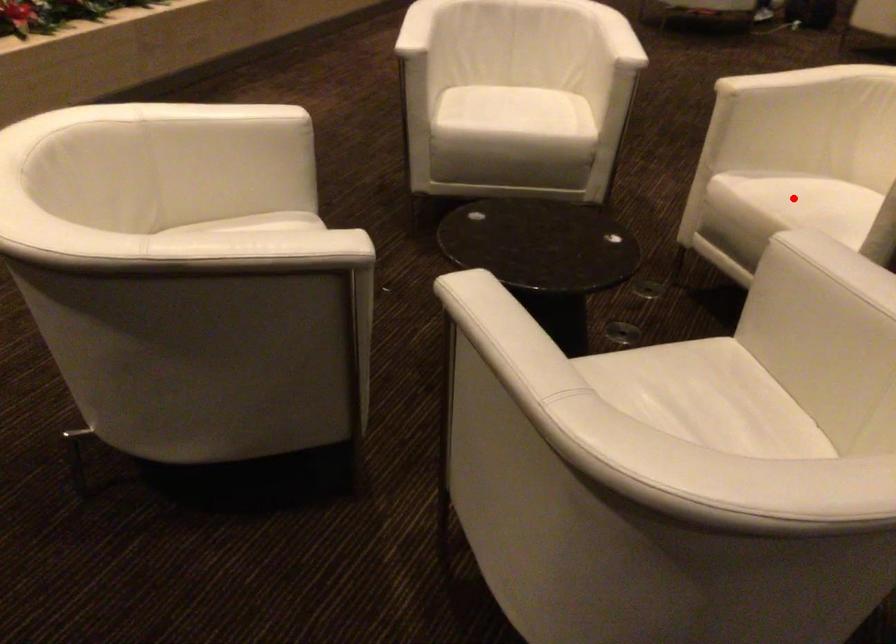
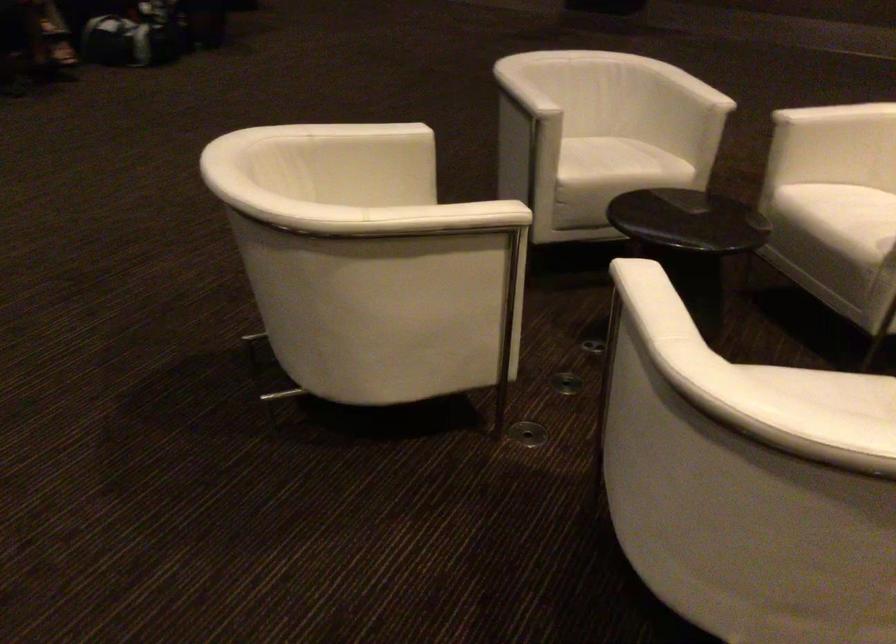
Question: I am providing you with two images of the same scene from different viewpoints. A red point is marked on the first image. At the location where the point appears in image 1, is it still visible in image 2?

Choices:
 (A) Yes
 (B) No

Answer: (B)